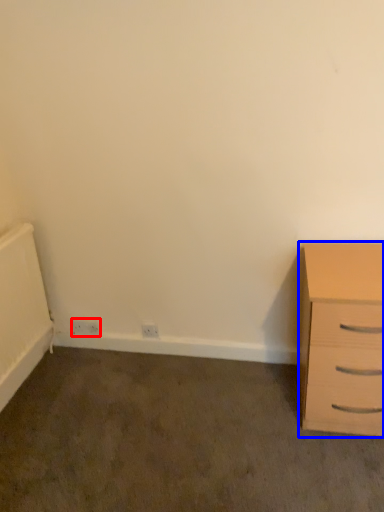
Question: Which object appears farthest to the camera in this image, electric outlet (highlighted by a red box) or chest of drawers (highlighted by a blue box)?

Choices:
 (A) electric outlet
 (B) chest of drawers

Answer: (A)